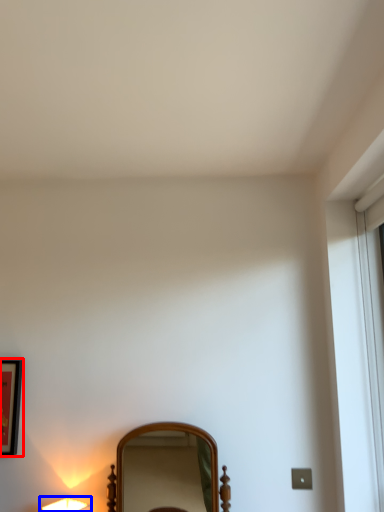
Question: Which point is further to the camera, picture frame (highlighted by a red box) or lamp (highlighted by a blue box)?

Choices:
 (A) picture frame
 (B) lamp

Answer: (A)